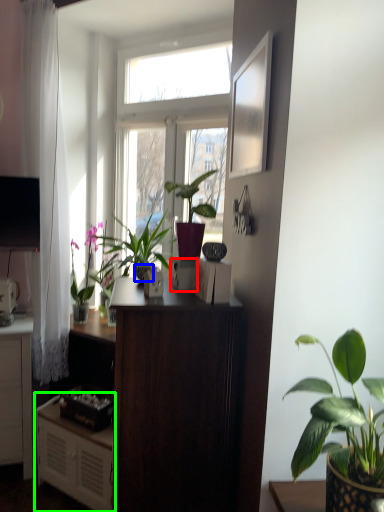
Question: Which object is the farthest from appliance (highlighted by a red box)? Choose among these: flowerpot (highlighted by a blue box) or cabinetry (highlighted by a green box).

Choices:
 (A) flowerpot
 (B) cabinetry

Answer: (B)